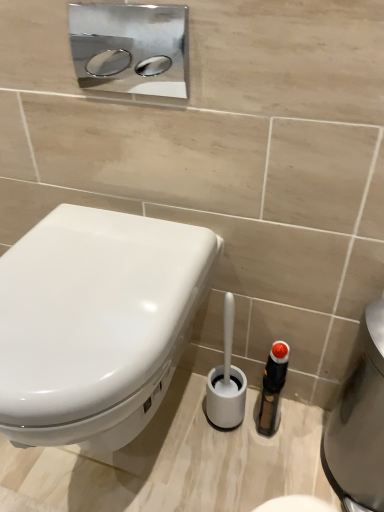
The height and width of the screenshot is (512, 384). I want to click on empty space that is ontop of white glossy toilet at left, so click(83, 275).